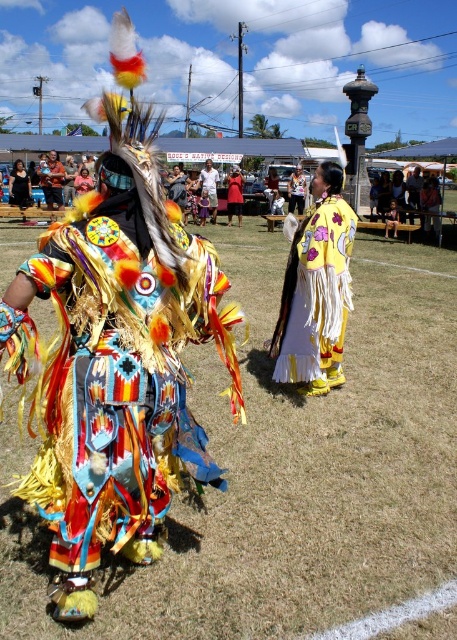
Question: Which point appears closest to the camera in this image?

Choices:
 (A) (20, 198)
 (B) (341, 202)

Answer: (B)

Question: Is yellow satin cape at center below matte black dress at center?

Choices:
 (A) yes
 (B) no

Answer: (A)

Question: In this image, where is yellow fabric dress at center located relative to matte yellow fabric dress at center?

Choices:
 (A) above
 (B) below

Answer: (A)

Question: Which point is farther from the camera taking this photo?

Choices:
 (A) (299, 180)
 (B) (242, 193)

Answer: (A)

Question: Does yellow satin cape at center have a greater width compared to yellow fabric dress at center?

Choices:
 (A) no
 (B) yes

Answer: (B)

Question: Which of the following is the farthest from the observer?

Choices:
 (A) [x=238, y=216]
 (B) [x=329, y=220]
 (C) [x=292, y=186]

Answer: (C)